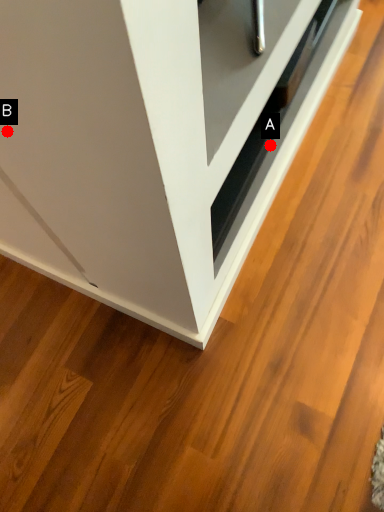
Question: Two points are circled on the image, labeled by A and B beside each circle. Which of the following is the closest to the observer?

Choices:
 (A) A is closer
 (B) B is closer

Answer: (B)